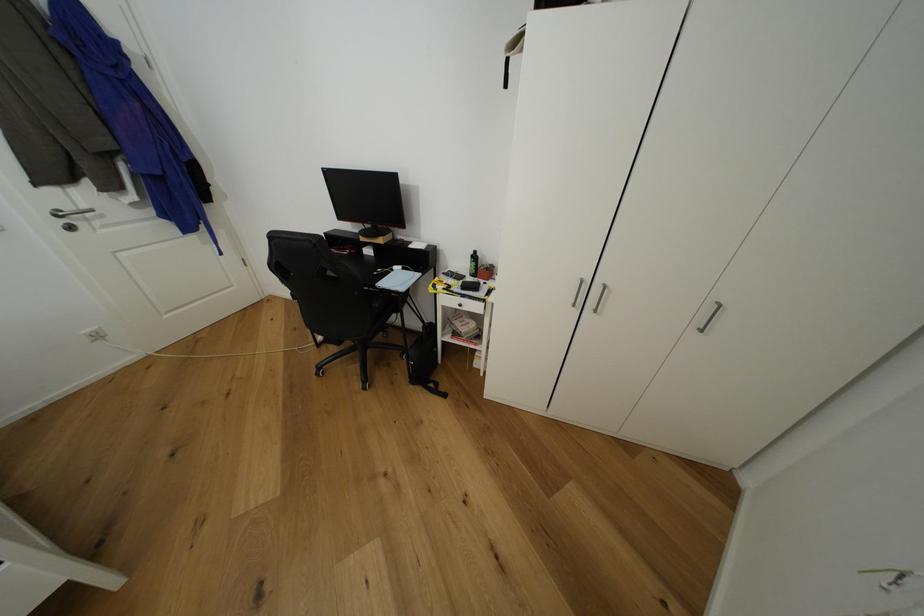
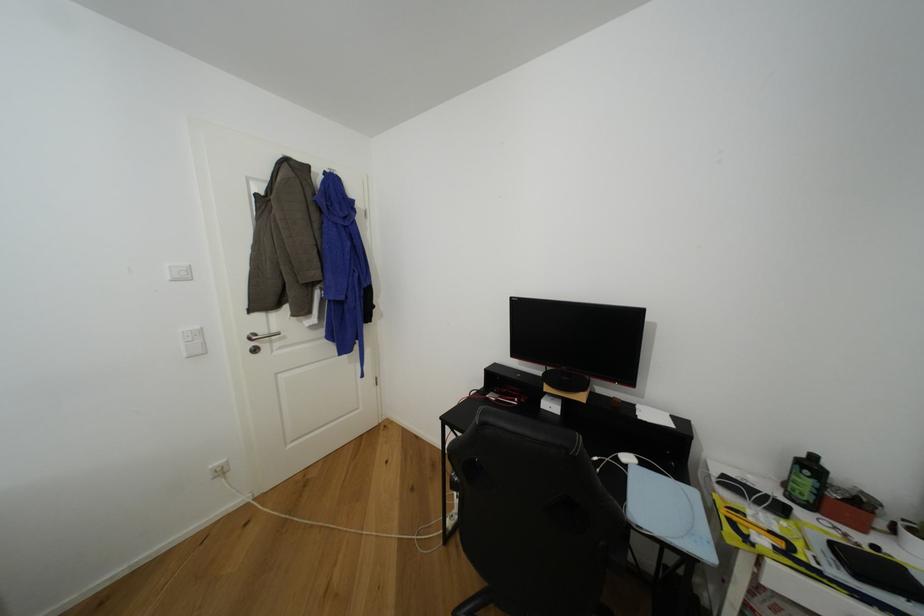
How did the camera likely rotate?

The camera's rotation is toward left-up.